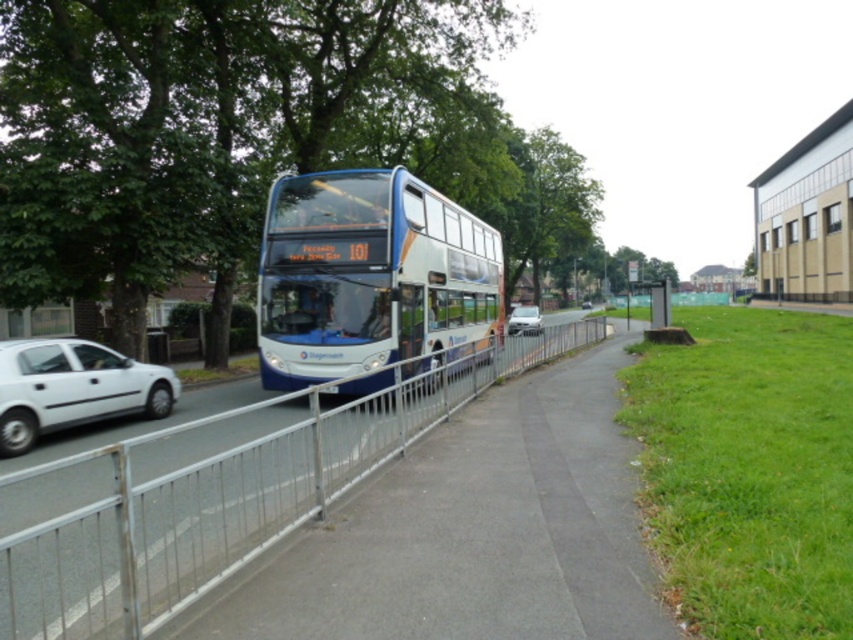
Between white matte car at left and metallic silver bus stop at right, which one has more height?

metallic silver bus stop at right is taller.

Based on the photo, can you confirm if white matte car at left is positioned to the left of metallic silver bus stop at right?

Correct, you'll find white matte car at left to the left of metallic silver bus stop at right.

At what (x,y) coordinates should I click in order to perform the action: click on white matte car at left. Please return your answer as a coordinate pair (x, y). Image resolution: width=853 pixels, height=640 pixels. Looking at the image, I should click on (73, 388).

I want to click on white matte car at left, so click(73, 388).

Is blue metallic bus at center smaller than metallic silver bus stop at right?

Yes.

Does blue metallic bus at center appear on the left side of metallic silver bus stop at right?

Indeed, blue metallic bus at center is positioned on the left side of metallic silver bus stop at right.

Image resolution: width=853 pixels, height=640 pixels. Find the location of `blue metallic bus at center`. blue metallic bus at center is located at coordinates (368, 275).

This screenshot has height=640, width=853. Find the location of `blue metallic bus at center`. blue metallic bus at center is located at coordinates (368, 275).

Which is below, silver metallic fence at center or white matte car at center?

silver metallic fence at center is lower down.

Between point (117, 605) and point (512, 323), which one is positioned in front?

Positioned in front is point (117, 605).

Is point (115, 589) behind point (517, 310)?

That is False.

You are a GUI agent. You are given a task and a screenshot of the screen. Output one action in this format:
    pyautogui.click(x=<x>, y=<y>)
    Task: Click on the silver metallic fence at center
    
    Given the screenshot: What is the action you would take?
    pyautogui.click(x=230, y=500)